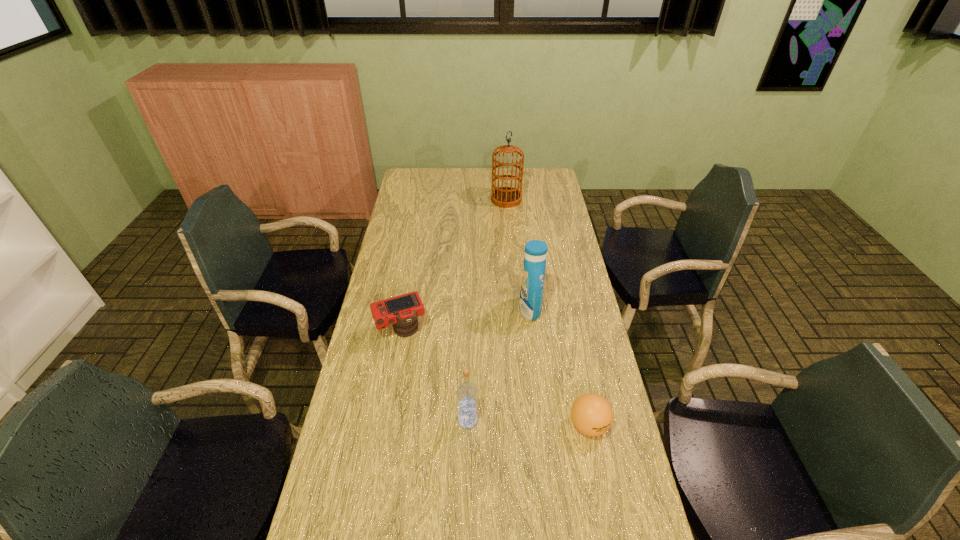
This screenshot has height=540, width=960. I want to click on free space located 0.310m on the front-facing side of the detergent, so click(434, 310).

At what (x,y) coordinates should I click in order to perform the action: click on free space located on the back of the vodka. Please return your answer as a coordinate pair (x, y). The image size is (960, 540). Looking at the image, I should click on (468, 385).

Find the location of a particular element. free space located on the back of the camera is located at coordinates (408, 292).

Where is `vacant space situated 0.190m on the side with brand of the ping-pong ball`? Image resolution: width=960 pixels, height=540 pixels. vacant space situated 0.190m on the side with brand of the ping-pong ball is located at coordinates (607, 517).

Where is `object that is at the far edge`? The image size is (960, 540). object that is at the far edge is located at coordinates (506, 197).

Image resolution: width=960 pixels, height=540 pixels. I want to click on object that is positioned at the left edge, so click(401, 311).

The width and height of the screenshot is (960, 540). I want to click on object present at the right edge, so click(591, 414).

Locate an element on the screen. free location at the left edge is located at coordinates (408, 256).

In the image, there is a desktop. At what (x,y) coordinates should I click in order to perform the action: click on vacant space at the right edge. Please return your answer as a coordinate pair (x, y). Image resolution: width=960 pixels, height=540 pixels. Looking at the image, I should click on (576, 481).

You are a GUI agent. You are given a task and a screenshot of the screen. Output one action in this format:
    pyautogui.click(x=<x>, y=<y>)
    Task: Click on the vacant region at the far left corner of the desktop
    
    Given the screenshot: What is the action you would take?
    pyautogui.click(x=400, y=190)